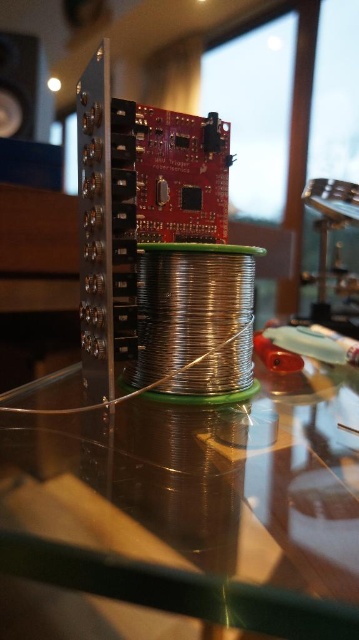
In the scene shown: Who is positioned more to the right, transparent glass table at center or black glossy speaker at upper left?

From the viewer's perspective, transparent glass table at center appears more on the right side.

What do you see at coordinates (183, 518) in the screenshot? The image size is (359, 640). I see `transparent glass table at center` at bounding box center [183, 518].

Where is `transparent glass table at center`? The height and width of the screenshot is (640, 359). transparent glass table at center is located at coordinates pyautogui.click(x=183, y=518).